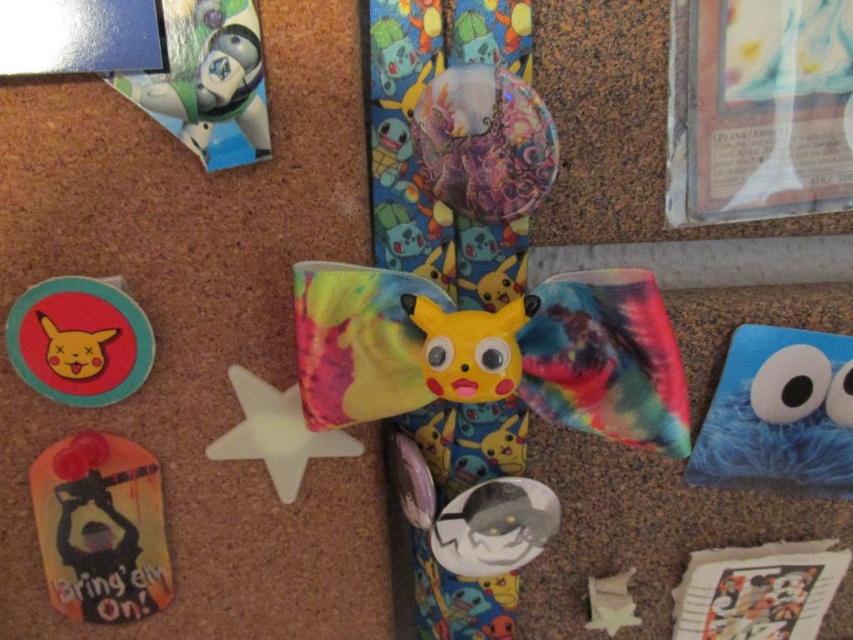
Question: From the image, what is the correct spatial relationship of shiny metallic buzz lightyear at upper left in relation to white plastic star at center?

Choices:
 (A) below
 (B) above

Answer: (B)

Question: Is blue fuzzy cookie monster at lower right wider than shiny metallic buzz lightyear at upper left?

Choices:
 (A) yes
 (B) no

Answer: (A)

Question: Among these objects, which one is farthest from the camera?

Choices:
 (A) shiny metallic buzz lightyear at upper left
 (B) matte red circle at upper left
 (C) white plastic star at center

Answer: (C)

Question: Among these points, which one is farthest from the camera?

Choices:
 (A) (447, 355)
 (B) (83, 547)
 (C) (737, 483)

Answer: (C)

Question: Which point is farther to the camera?

Choices:
 (A) (279, 458)
 (B) (747, 339)
 (C) (70, 612)

Answer: (A)

Question: Does silhouette paper bookmark at lower left have a smaller size compared to shiny metallic buzz lightyear at upper left?

Choices:
 (A) no
 (B) yes

Answer: (A)